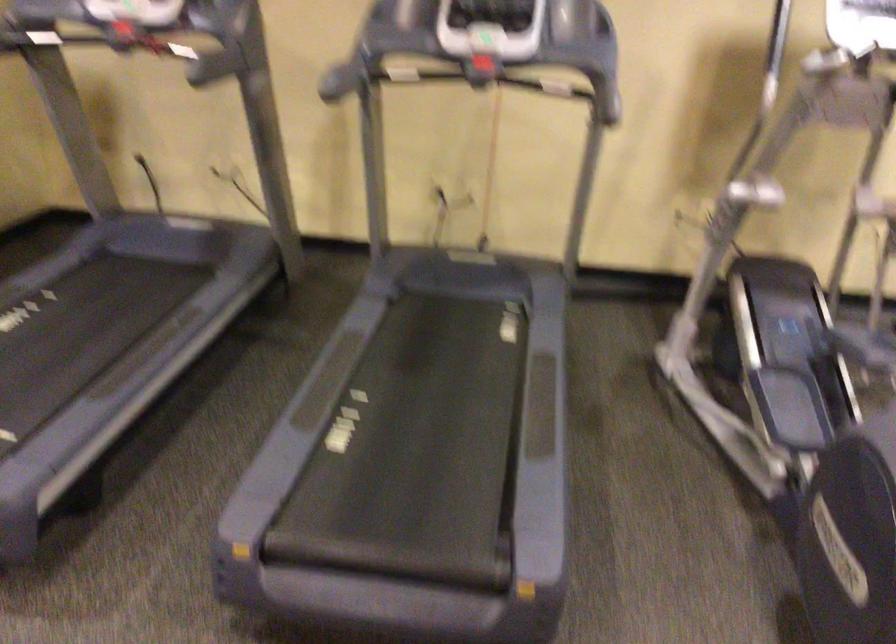
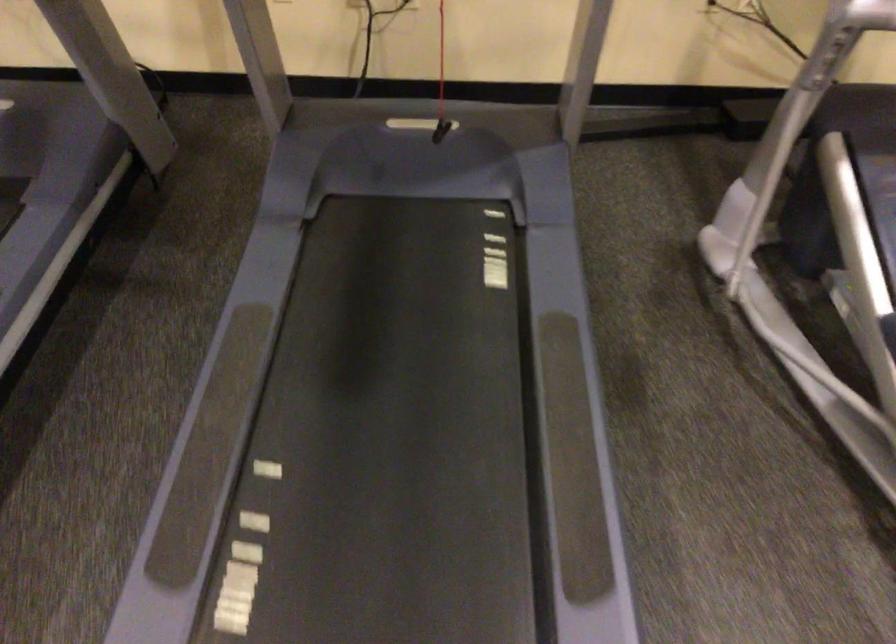
Question: In a continuous first-person perspective shot, in which direction is the camera moving?

Choices:
 (A) Left
 (B) Right
 (C) Forward
 (D) Backward

Answer: (C)